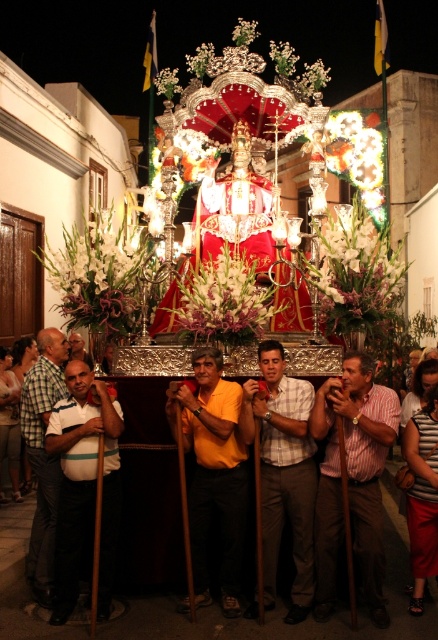
You are a photographer at the festival and want to capture both the striped cotton shirt at center and the white striped polo shirt at left in a single frame. Since you want to emphasize the size difference between them, where should you position your camera relative to the shirts?

To emphasize the size difference between the striped cotton shirt at center and the white striped polo shirt at left, position the camera closer to the striped cotton shirt at center. This will make it appear larger in the frame compared to the white striped polo shirt at left, which is smaller in reality and farther away.